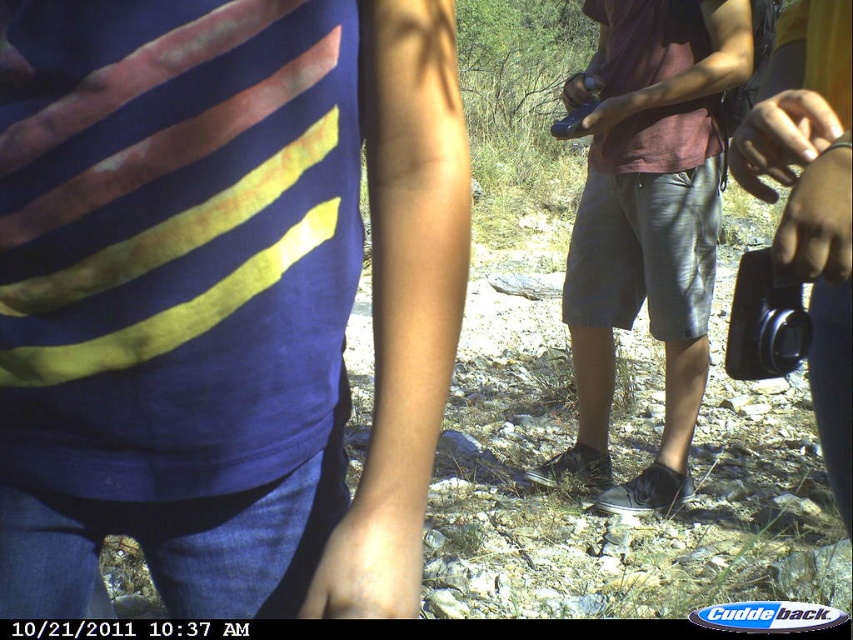
Can you confirm if dark gray denim shorts at center is positioned to the left of black plastic camera at right?

No, dark gray denim shorts at center is not to the left of black plastic camera at right.

Between dark gray denim shorts at center and black plastic camera at right, which one has more height?

Standing taller between the two is dark gray denim shorts at center.

Which is behind, point (596, 372) or point (805, 342)?

Positioned behind is point (596, 372).

The width and height of the screenshot is (853, 640). Find the location of `dark gray denim shorts at center`. dark gray denim shorts at center is located at coordinates (647, 220).

Who is positioned more to the left, blue matte shirt at center or dark gray denim shorts at center?

From the viewer's perspective, blue matte shirt at center appears more on the left side.

Does blue matte shirt at center appear on the right side of dark gray denim shorts at center?

In fact, blue matte shirt at center is to the left of dark gray denim shorts at center.

Based on the photo, who is more distant from viewer, (169, 48) or (584, 188)?

Point (584, 188)

Identify the location of blue matte shirt at center. This screenshot has height=640, width=853. (222, 296).

Is blue matte shirt at center above black plastic camera at right?

No, blue matte shirt at center is not above black plastic camera at right.

Can you confirm if blue matte shirt at center is bigger than black plastic camera at right?

Indeed, blue matte shirt at center has a larger size compared to black plastic camera at right.

Which is behind, point (315, 362) or point (737, 269)?

Positioned behind is point (737, 269).

Identify the location of blue matte shirt at center. This screenshot has height=640, width=853. tap(222, 296).